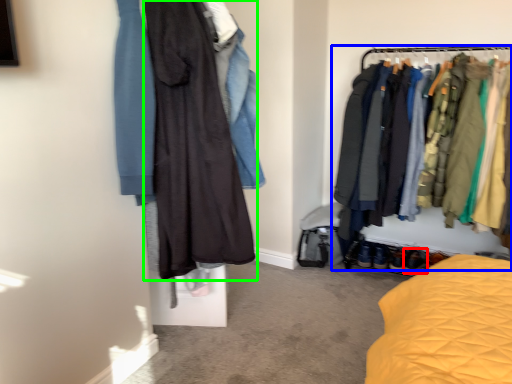
Question: Which is farther away from footwear (highlighted by a red box)? closet (highlighted by a blue box) or fancy dress (highlighted by a green box)?

Choices:
 (A) closet
 (B) fancy dress

Answer: (B)